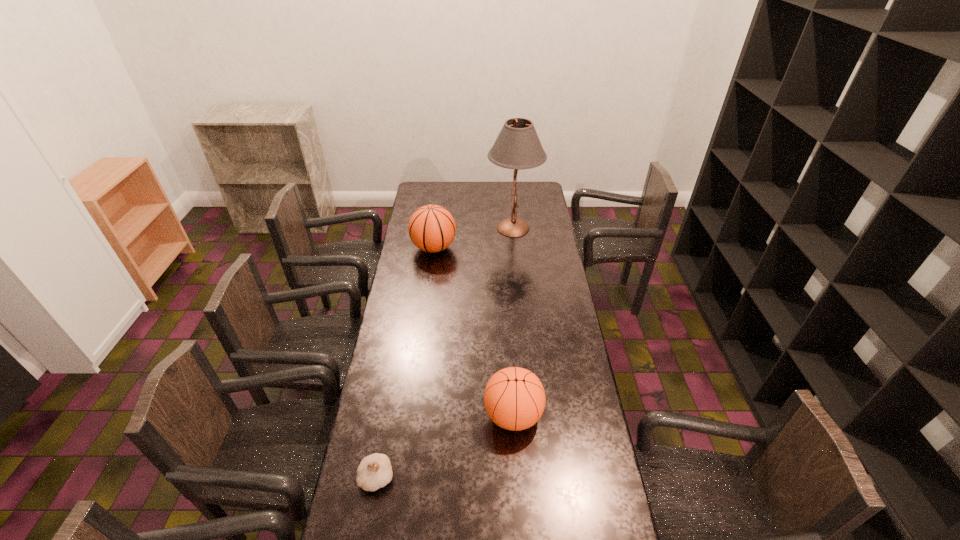
Identify the location of vacant point located between the second shortest object and the second tallest object. The image size is (960, 540). (473, 332).

Locate an element on the screen. Image resolution: width=960 pixels, height=540 pixels. unoccupied position between the shortest object and the left basketball is located at coordinates (405, 363).

This screenshot has width=960, height=540. I want to click on vacant space that is in between the left basketball and the nearest object, so click(x=405, y=363).

I want to click on free space between the right basketball and the shortest object, so click(x=445, y=446).

Where is `free space between the nearest object and the third tallest object`? The image size is (960, 540). free space between the nearest object and the third tallest object is located at coordinates (445, 446).

At what (x,y) coordinates should I click in order to perform the action: click on free space between the nearer basketball and the table lamp. Please return your answer as a coordinate pair (x, y). Looking at the image, I should click on pos(514,321).

You are a GUI agent. You are given a task and a screenshot of the screen. Output one action in this format:
    pyautogui.click(x=<x>, y=<y>)
    Task: Click on the unoccupied position between the right basketball and the tallest object
    
    Given the screenshot: What is the action you would take?
    pyautogui.click(x=514, y=321)

Find the location of `free area in between the tallest object and the third tallest object`. free area in between the tallest object and the third tallest object is located at coordinates (514, 321).

Image resolution: width=960 pixels, height=540 pixels. I want to click on free space that is in between the second tallest object and the tallest object, so click(x=473, y=238).

I want to click on blank region between the garlic and the tallest object, so click(445, 353).